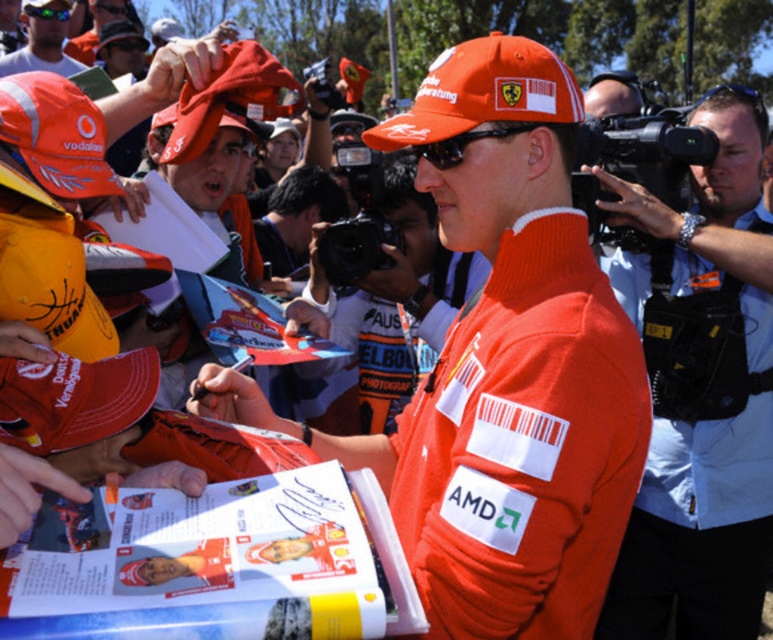
Who is more forward, (722, 132) or (465, 84)?

Positioned in front is point (465, 84).

Identify the location of orange fabric shirt at right. The width and height of the screenshot is (773, 640). (700, 392).

Is orange fabric shirt at right shorter than orange fabric cap at lower left?

No, orange fabric shirt at right is not shorter than orange fabric cap at lower left.

Where is `orange fabric shirt at right`? The width and height of the screenshot is (773, 640). orange fabric shirt at right is located at coordinates (700, 392).

Where is `orange fabric shirt at right`? This screenshot has width=773, height=640. orange fabric shirt at right is located at coordinates (700, 392).

Find the location of a particular element. This screenshot has height=640, width=773. orange matte cap at center is located at coordinates (482, 92).

Which is in front, point (554, 92) or point (49, 376)?

Positioned in front is point (554, 92).

Identify the location of orange matte cap at center. The height and width of the screenshot is (640, 773). (482, 92).

I want to click on orange matte cap at center, so click(482, 92).